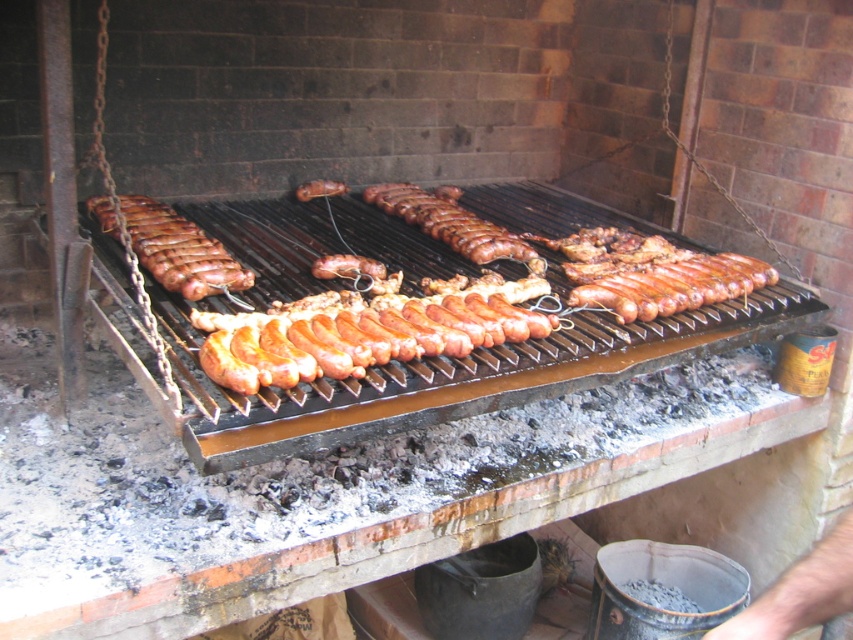
You are a drone operator trying to deliver a small package to the shiny brown sausage at left located at point 0.392, 0.212. The grill is surrounded by a 0.5 meter wide safety zone. Can you land your drone within the safety zone to drop the package?

The safety zone around the grill is 0.5 meters wide. Since the shiny brown sausage at left is located at point (180, 250), the drone can land within the safety zone to drop the package as long as the coordinates are within the designated area.

Consider the image. You are standing in front of the barbecue grill and want to touch both points labeled as point (189, 292) and point (515, 259). Which point will require you to reach further away from your body?

Point (515, 259) is further away from the camera than point (189, 292), so you will need to reach further away from your body to touch point (515, 259).